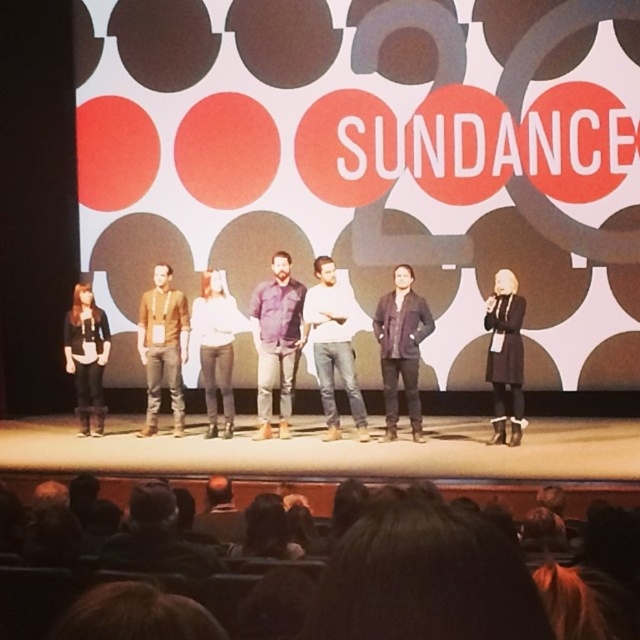
Question: Is white cotton shirt at center closer to the viewer compared to white matte shirt at center?

Choices:
 (A) no
 (B) yes

Answer: (B)

Question: Which point appears farthest from the camera in this image?

Choices:
 (A) (285, 308)
 (B) (339, 340)

Answer: (A)

Question: Among these points, which one is nearest to the camera?

Choices:
 (A) (208, 371)
 (B) (378, 321)
 (C) (280, 316)

Answer: (B)

Question: Is brown leather jacket at center above matte black jacket at left?

Choices:
 (A) yes
 (B) no

Answer: (A)

Question: Which of the following is the closest to the observer?

Choices:
 (A) (160, 304)
 (B) (88, 362)
 (C) (220, 384)

Answer: (C)

Question: Can you confirm if purple cotton shirt at center is bigger than white matte shirt at center?

Choices:
 (A) no
 (B) yes

Answer: (B)